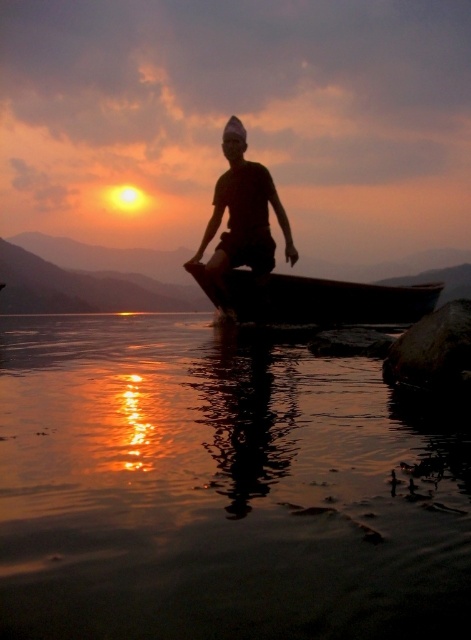
Question: In this image, where is wooden canoe at center located relative to matte black shirt at center?

Choices:
 (A) right
 (B) left

Answer: (A)

Question: Which object is farther from the camera taking this photo?

Choices:
 (A) matte black shirt at center
 (B) transparent water at center
 (C) wooden canoe at center

Answer: (C)

Question: Does transparent water at center have a lesser width compared to matte black shirt at center?

Choices:
 (A) yes
 (B) no

Answer: (B)

Question: Among these objects, which one is farthest from the camera?

Choices:
 (A) matte black shirt at center
 (B) wooden canoe at center
 (C) transparent water at center

Answer: (B)

Question: Does transparent water at center appear on the right side of wooden canoe at center?

Choices:
 (A) no
 (B) yes

Answer: (A)

Question: Which object is positioned closest to the wooden canoe at center?

Choices:
 (A) transparent water at center
 (B) matte black shirt at center

Answer: (B)